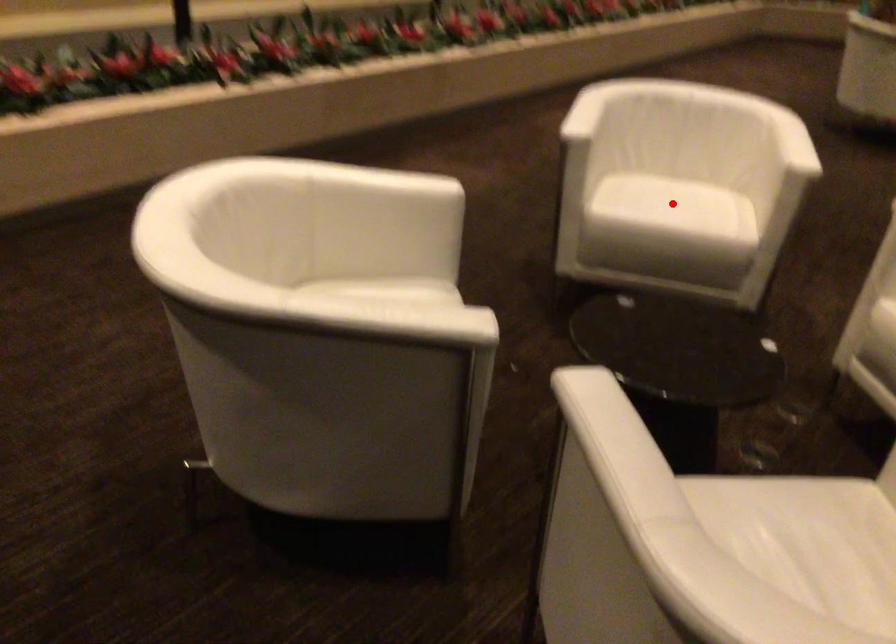
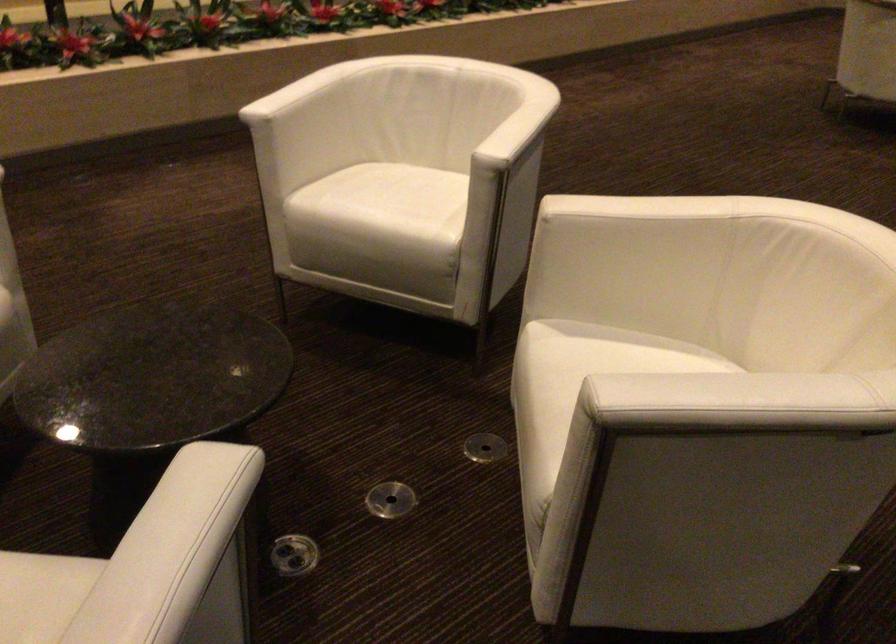
Find the pixel in the second image that matches the highlighted location in the first image.

(383, 205)